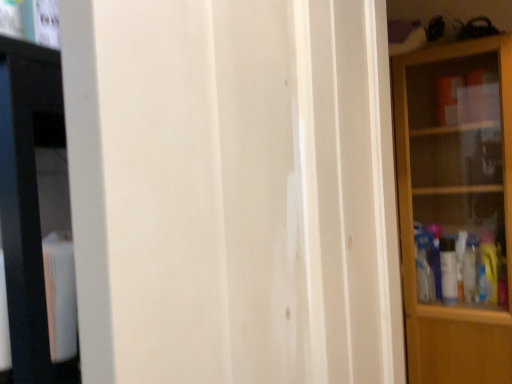
Question: Is transparent glass cabinet at right surrounded by white wood screen door at center?

Choices:
 (A) yes
 (B) no

Answer: (B)

Question: Is white wood screen door at center positioned in front of transparent glass cabinet at right?

Choices:
 (A) yes
 (B) no

Answer: (A)

Question: Can you confirm if white wood screen door at center is positioned to the right of transparent glass cabinet at right?

Choices:
 (A) yes
 (B) no

Answer: (B)

Question: From the image's perspective, is white wood screen door at center on top of transparent glass cabinet at right?

Choices:
 (A) yes
 (B) no

Answer: (A)

Question: Is white wood screen door at center outside transparent glass cabinet at right?

Choices:
 (A) no
 (B) yes

Answer: (B)

Question: Is white wood screen door at center to the left of transparent glass cabinet at right from the viewer's perspective?

Choices:
 (A) no
 (B) yes

Answer: (B)

Question: Is the position of transparent glass cabinet at right more distant than that of white wood screen door at center?

Choices:
 (A) no
 (B) yes

Answer: (B)

Question: Is transparent glass cabinet at right turned away from white wood screen door at center?

Choices:
 (A) yes
 (B) no

Answer: (B)

Question: Is transparent glass cabinet at right next to white wood screen door at center and touching it?

Choices:
 (A) yes
 (B) no

Answer: (B)

Question: Would you say transparent glass cabinet at right contains white wood screen door at center?

Choices:
 (A) yes
 (B) no

Answer: (B)

Question: Does transparent glass cabinet at right have a smaller size compared to white wood screen door at center?

Choices:
 (A) no
 (B) yes

Answer: (A)

Question: From the image's perspective, is transparent glass cabinet at right beneath white wood screen door at center?

Choices:
 (A) no
 (B) yes

Answer: (B)

Question: Considering the positions of transparent glass cabinet at right and white wood screen door at center in the image, is transparent glass cabinet at right wider or thinner than white wood screen door at center?

Choices:
 (A) thin
 (B) wide

Answer: (B)